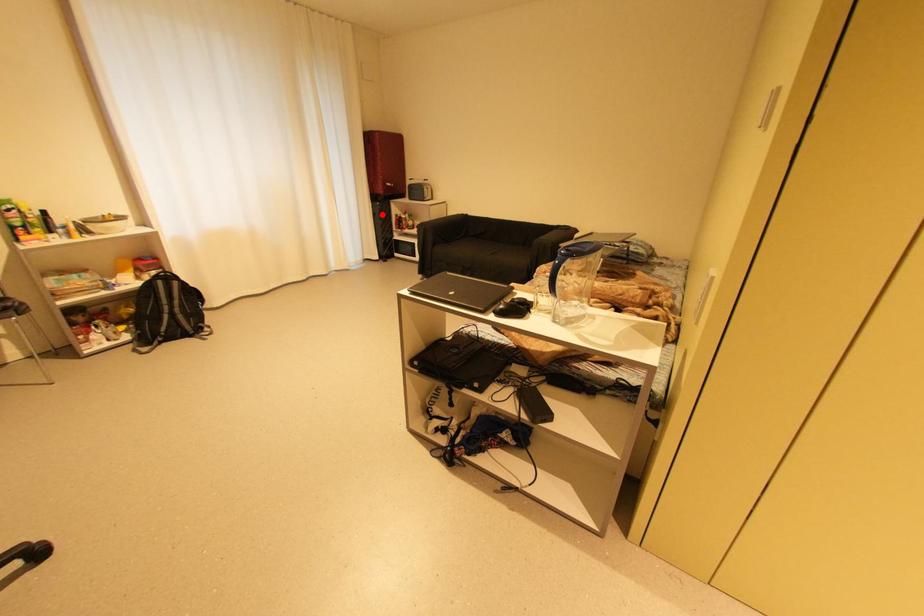
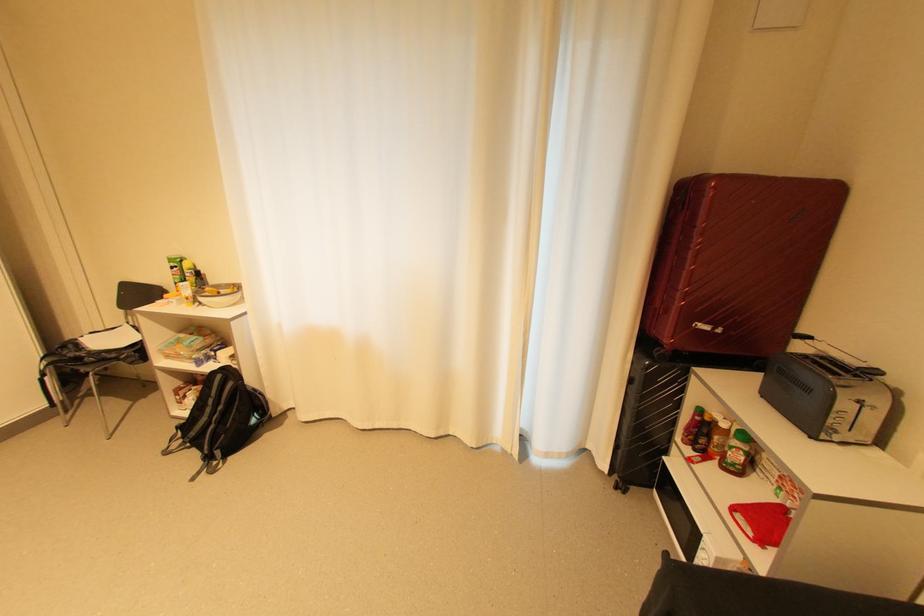
Question: I am providing you with two images of the same scene from different viewpoints. In image1, a red point is highlighted. Considering the same 3D point in image2, which of the following is correct?

Choices:
 (A) It is closer
 (B) It is farther

Answer: (B)